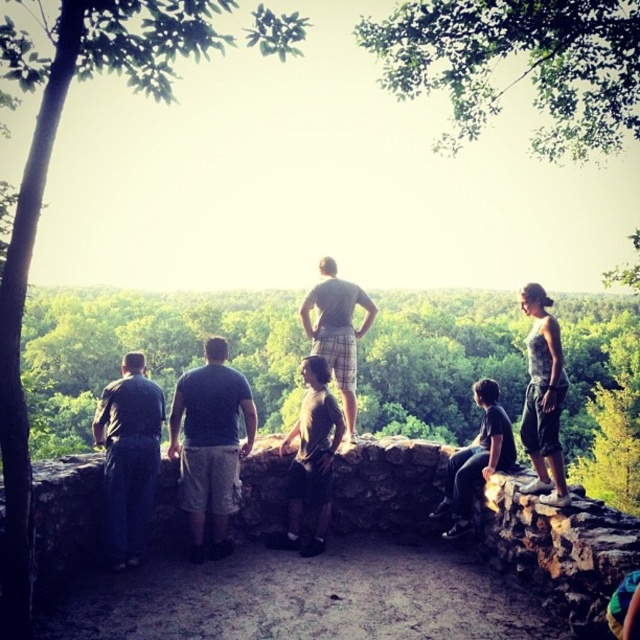
You are a photographer trying to capture a photo of the dark gray cotton shirt at center and the printed cotton tank top at right in the same frame. Given that your camera has a focal length of 5 meters, will you be able to include both subjects in the photo?

The dark gray cotton shirt at center and printed cotton tank top at right are 5.42 meters apart. Since the camera has a focal length of 5 meters, which is shorter than the distance between the two subjects, the photographer might not be able to capture both in the same frame without adjusting the camera settings or moving closer.

You are a photographer trying to capture a photo of the dark gray cotton shirt at center and the printed cotton tank top at right. Which of the two is positioned higher in the image?

The dark gray cotton shirt at center is positioned higher than the printed cotton tank top at right in the image.